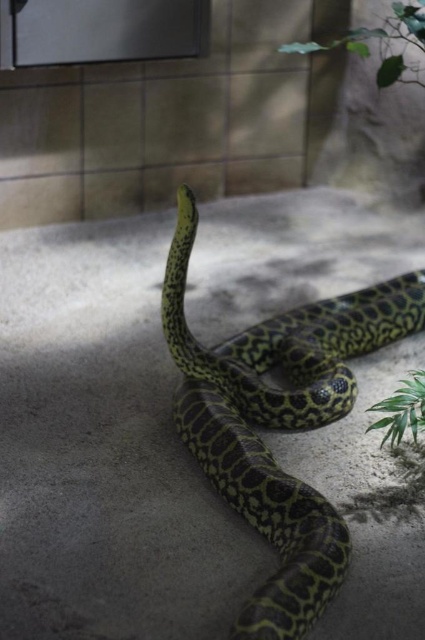
Can you confirm if green textured snake at center is positioned above green leafy plant at lower right?

Correct, green textured snake at center is located above green leafy plant at lower right.

Who is shorter, green textured snake at center or green leafy plant at lower right?

Standing shorter between the two is green leafy plant at lower right.

Where is `green textured snake at center`? The height and width of the screenshot is (640, 425). green textured snake at center is located at coordinates (278, 420).

Find the location of a particular element. The height and width of the screenshot is (640, 425). green textured snake at center is located at coordinates (278, 420).

Does green leafy plant at upper right appear on the right side of green leafy plant at lower right?

Incorrect, green leafy plant at upper right is not on the right side of green leafy plant at lower right.

Who is positioned more to the left, green leafy plant at upper right or green leafy plant at lower right?

green leafy plant at upper right is more to the left.

Does point (385, 76) lie behind point (422, 396)?

That is True.

The height and width of the screenshot is (640, 425). Find the location of `green leafy plant at upper right`. green leafy plant at upper right is located at coordinates (380, 44).

In the scene shown: Who is taller, green textured snake at center or green leafy plant at upper right?

green textured snake at center is taller.

Does green textured snake at center have a larger size compared to green leafy plant at upper right?

Correct, green textured snake at center is larger in size than green leafy plant at upper right.

Image resolution: width=425 pixels, height=640 pixels. In order to click on green textured snake at center in this screenshot , I will do `click(278, 420)`.

Where is `green textured snake at center`? The width and height of the screenshot is (425, 640). green textured snake at center is located at coordinates (278, 420).